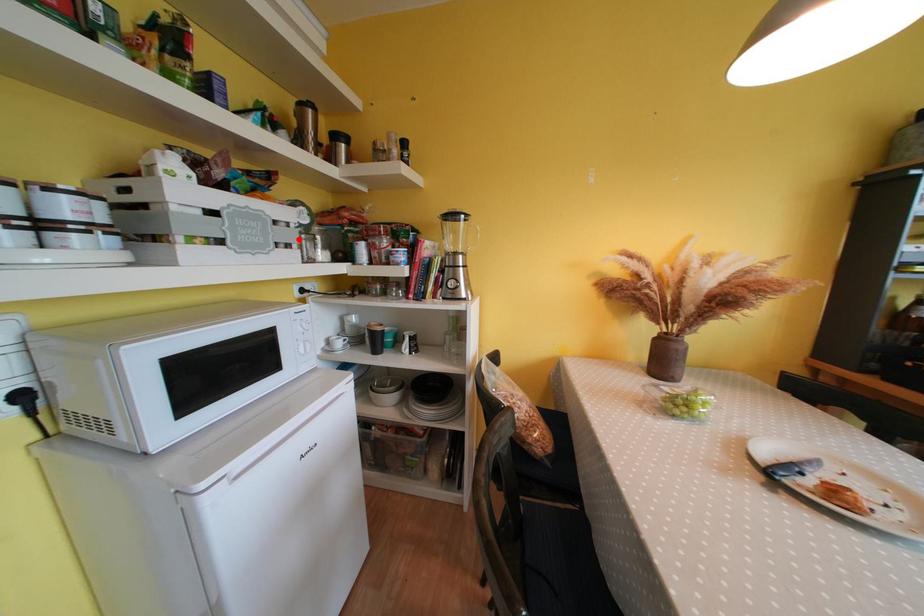
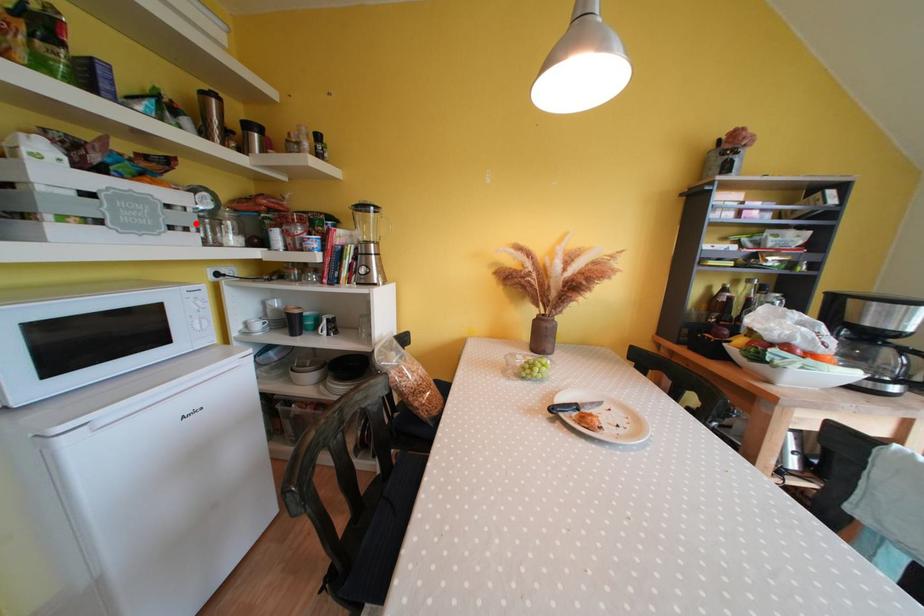
I am providing you with two images of the same scene from different viewpoints. A red point is marked on the first image and another point is marked on the second image. Do the highlighted points in image1 and image2 indicate the same real-world spot?

Yes